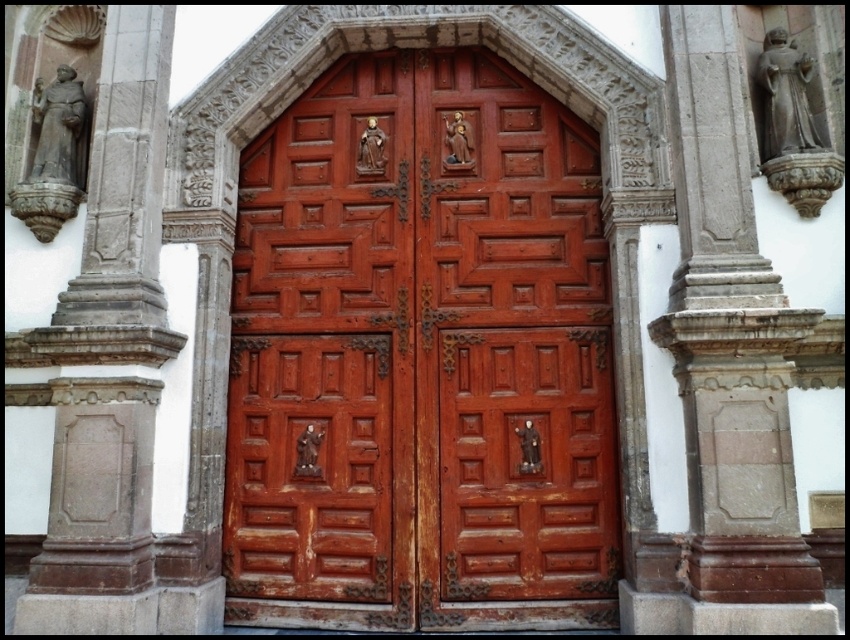
Question: Which object appears farthest from the camera in this image?

Choices:
 (A) rustic wood door at center
 (B) gray stone statue at left

Answer: (A)

Question: Does rustic wood door at center come in front of gray stone statue at left?

Choices:
 (A) no
 (B) yes

Answer: (A)

Question: Does rustic wood door at center appear over gray stone statue at left?

Choices:
 (A) yes
 (B) no

Answer: (B)

Question: Is rustic wood door at center positioned before gray stone statue at left?

Choices:
 (A) yes
 (B) no

Answer: (B)

Question: Which object appears closest to the camera in this image?

Choices:
 (A) rustic wood door at center
 (B) gray stone statue at left

Answer: (B)

Question: Among these points, which one is nearest to the camera?

Choices:
 (A) (80, 612)
 (B) (476, 552)

Answer: (A)